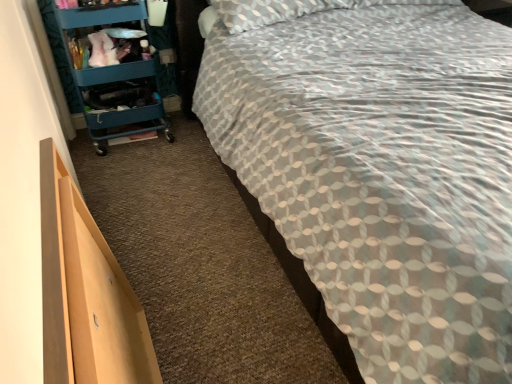
Question: From the image's perspective, is patterned fabric bed at center on top of light wood drawer at lower left?

Choices:
 (A) yes
 (B) no

Answer: (A)

Question: From a real-world perspective, is patterned fabric bed at center over light wood drawer at lower left?

Choices:
 (A) yes
 (B) no

Answer: (A)

Question: Is patterned fabric bed at center not within light wood drawer at lower left?

Choices:
 (A) no
 (B) yes

Answer: (B)

Question: Is patterned fabric bed at center thinner than light wood drawer at lower left?

Choices:
 (A) yes
 (B) no

Answer: (B)

Question: Considering the relative sizes of patterned fabric bed at center and light wood drawer at lower left in the image provided, is patterned fabric bed at center wider than light wood drawer at lower left?

Choices:
 (A) yes
 (B) no

Answer: (A)

Question: Is teal plastic cart at left in front of or behind patterned fabric bed at center in the image?

Choices:
 (A) front
 (B) behind

Answer: (B)

Question: From a real-world perspective, is teal plastic cart at left above or below patterned fabric bed at center?

Choices:
 (A) above
 (B) below

Answer: (B)

Question: Is teal plastic cart at left to the left or to the right of patterned fabric bed at center in the image?

Choices:
 (A) right
 (B) left

Answer: (B)

Question: Which is correct: teal plastic cart at left is inside patterned fabric bed at center, or outside of it?

Choices:
 (A) outside
 (B) inside

Answer: (A)

Question: Relative to light wood drawer at lower left, is patterned fabric bed at center in front or behind?

Choices:
 (A) front
 (B) behind

Answer: (A)

Question: Looking at the image, does patterned fabric bed at center seem bigger or smaller compared to light wood drawer at lower left?

Choices:
 (A) small
 (B) big

Answer: (B)

Question: From the image's perspective, relative to light wood drawer at lower left, is patterned fabric bed at center above or below?

Choices:
 (A) above
 (B) below

Answer: (A)

Question: Considering the positions of point (376, 36) and point (56, 203), is point (376, 36) closer or farther from the camera than point (56, 203)?

Choices:
 (A) farther
 (B) closer

Answer: (A)

Question: In terms of width, does light wood drawer at lower left look wider or thinner when compared to patterned fabric bed at center?

Choices:
 (A) thin
 (B) wide

Answer: (A)

Question: Does point (46, 329) appear closer or farther from the camera than point (506, 175)?

Choices:
 (A) closer
 (B) farther

Answer: (A)